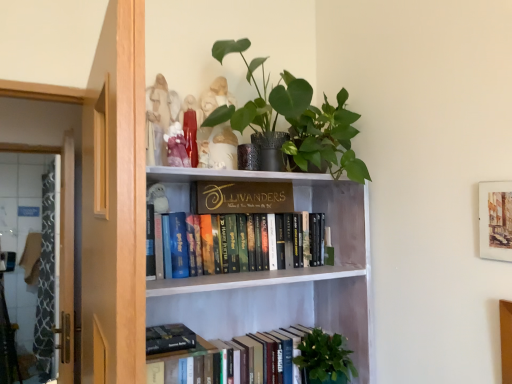
What do you see at coordinates (188, 356) in the screenshot? I see `hardcover book at lower center, placed as the first book when sorted from bottom to top` at bounding box center [188, 356].

What do you see at coordinates (283, 273) in the screenshot? I see `white wood bookshelf at upper center` at bounding box center [283, 273].

The height and width of the screenshot is (384, 512). Describe the element at coordinates (242, 197) in the screenshot. I see `gold metallic sign at upper center` at that location.

Measure the distance between green matte plant at upper center and camera.

green matte plant at upper center and camera are 1.31 meters apart.

Locate an element on the screen. green matte plant at lower center is located at coordinates (325, 358).

Find the location of a particular element. The width and height of the screenshot is (512, 384). watercolor paper picture frame at upper right is located at coordinates (495, 220).

From a real-world perspective, who is located higher, hardcover books at center, arranged as the second book when ordered from the bottom, or green matte plant at lower center?

In real-world perspective, hardcover books at center, arranged as the second book when ordered from the bottom, is above.

Who is smaller, hardcover books at center, the first book from the top, or green matte plant at lower center?

green matte plant at lower center.

Can you confirm if hardcover books at center, the first book from the top, is thinner than green matte plant at lower center?

Correct, the width of hardcover books at center, the first book from the top, is less than that of green matte plant at lower center.

From a real-world perspective, is gold metallic sign at upper center positioned above or below green matte plant at upper center?

Clearly, from a real-world perspective, gold metallic sign at upper center is below green matte plant at upper center.

Which of these two, gold metallic sign at upper center or green matte plant at upper center, is thinner?

gold metallic sign at upper center.

Is gold metallic sign at upper center not close to green matte plant at upper center?

That's not correct — gold metallic sign at upper center is a little close to green matte plant at upper center.

Between wooden screen door at left and green matte plant at lower center, which one appears on the left side from the viewer's perspective?

Positioned to the left is wooden screen door at left.

Considering their positions, is wooden screen door at left located in front of or behind green matte plant at lower center?

Clearly, wooden screen door at left is behind green matte plant at lower center.

From the image's perspective, is wooden screen door at left above green matte plant at lower center?

Yes, from the image's perspective, wooden screen door at left is over green matte plant at lower center.

Does hardcover books at center, arranged as the second book when ordered from the bottom, have a lesser height compared to hardcover book at lower center, the 2th book in the top-to-bottom sequence?

In fact, hardcover books at center, arranged as the second book when ordered from the bottom, may be taller than hardcover book at lower center, the 2th book in the top-to-bottom sequence.

Locate an element on the screen. book above the hardcover book at lower center, the 2th book in the top-to-bottom sequence (from a real-world perspective) is located at coordinates (246, 276).

Which of these two, hardcover books at center, the first book from the top, or hardcover book at lower center, the 2th book in the top-to-bottom sequence, is wider?

hardcover book at lower center, the 2th book in the top-to-bottom sequence, is wider.

Measure the distance from hardcover books at center, arranged as the second book when ordered from the bottom, to hardcover book at lower center, placed as the first book when sorted from bottom to top.

A distance of 11.28 inches exists between hardcover books at center, arranged as the second book when ordered from the bottom, and hardcover book at lower center, placed as the first book when sorted from bottom to top.

From the image's perspective, which one is positioned lower, wooden screen door at left or watercolor paper picture frame at upper right?

wooden screen door at left, from the image's perspective.

Considering the positions of objects wooden screen door at left and watercolor paper picture frame at upper right in the image provided, who is more to the left, wooden screen door at left or watercolor paper picture frame at upper right?

wooden screen door at left.

Is green matte plant at upper center inside the boundaries of wooden screen door at left, or outside?

green matte plant at upper center is spatially situated outside wooden screen door at left.

Are green matte plant at upper center and wooden screen door at left located far from each other?

green matte plant at upper center is positioned a significant distance from wooden screen door at left.

From the image's perspective, is green matte plant at upper center beneath wooden screen door at left?

No, from the image's perspective, green matte plant at upper center is not beneath wooden screen door at left.

Looking at this image, how different are the orientations of green matte plant at upper center and wooden screen door at left in degrees?

They differ by 88.9 degrees in their facing directions.

How many degrees apart are the facing directions of green matte plant at lower center and wooden screen door at left?

green matte plant at lower center and wooden screen door at left are facing 88.9 degrees away from each other.

Is the position of green matte plant at lower center less distant than that of wooden screen door at left?

Yes, green matte plant at lower center is in front of wooden screen door at left.

Is green matte plant at lower center not close to wooden screen door at left?

Yes, green matte plant at lower center and wooden screen door at left are quite far apart.

Who is taller, green matte plant at lower center or wooden screen door at left?

With more height is wooden screen door at left.

The image size is (512, 384). Find the location of `vegetation on the right of hardcover books at center, arranged as the second book when ordered from the bottom`. vegetation on the right of hardcover books at center, arranged as the second book when ordered from the bottom is located at coordinates tap(325, 358).

You are a GUI agent. You are given a task and a screenshot of the screen. Output one action in this format:
    pyautogui.click(x=<x>, y=<y>)
    Task: Click on the paperback book behind the green matte plant at upper center
    This screenshot has height=384, width=512.
    Given the screenshot: What is the action you would take?
    pyautogui.click(x=242, y=197)

From the image, which object appears to be nearer to hardcover books at center, arranged as the second book when ordered from the bottom, watercolor paper picture frame at upper right or hardcover book at lower center, placed as the first book when sorted from bottom to top?

Based on the image, hardcover book at lower center, placed as the first book when sorted from bottom to top, appears to be nearer to hardcover books at center, arranged as the second book when ordered from the bottom.

Which object lies nearer to the anchor point gold metallic sign at upper center, hardcover books at center, arranged as the second book when ordered from the bottom, or watercolor paper picture frame at upper right?

hardcover books at center, arranged as the second book when ordered from the bottom, lies closer to gold metallic sign at upper center than the other object.

From the image, which object appears to be nearer to hardcover books at center, arranged as the second book when ordered from the bottom, gold metallic sign at upper center or green matte plant at lower center?

gold metallic sign at upper center is positioned closer to the anchor hardcover books at center, arranged as the second book when ordered from the bottom.

Based on their spatial positions, is green matte plant at lower center or hardcover books at center, arranged as the second book when ordered from the bottom, further from gold metallic sign at upper center?

Based on the image, green matte plant at lower center appears to be further to gold metallic sign at upper center.

Considering their positions, is hardcover book at lower center, placed as the first book when sorted from bottom to top, positioned closer to white wood bookshelf at upper center than watercolor paper picture frame at upper right?

Among the two, hardcover book at lower center, placed as the first book when sorted from bottom to top, is located nearer to white wood bookshelf at upper center.

From the image, which object appears to be nearer to hardcover book at lower center, the 2th book in the top-to-bottom sequence, green matte plant at lower center or white wood bookshelf at upper center?

white wood bookshelf at upper center is positioned closer to the anchor hardcover book at lower center, the 2th book in the top-to-bottom sequence.

Based on their spatial positions, is white wood bookshelf at upper center or hardcover book at lower center, the 2th book in the top-to-bottom sequence, closer to green matte plant at lower center?

The object closer to green matte plant at lower center is hardcover book at lower center, the 2th book in the top-to-bottom sequence.

Looking at the image, which one is located closer to wooden screen door at left, hardcover books at center, the first book from the top, or green matte plant at lower center?

hardcover books at center, the first book from the top, is positioned closer to the anchor wooden screen door at left.

Identify the location of bookcase located between hardcover books at center, the first book from the top, and watercolor paper picture frame at upper right in the left-right direction. This screenshot has width=512, height=384. (283, 273).

Where is `paperback book located between hardcover book at lower center, the 2th book in the top-to-bottom sequence, and watercolor paper picture frame at upper right in the left-right direction`? The height and width of the screenshot is (384, 512). paperback book located between hardcover book at lower center, the 2th book in the top-to-bottom sequence, and watercolor paper picture frame at upper right in the left-right direction is located at coordinates click(242, 197).

This screenshot has height=384, width=512. What are the coordinates of `paperback book between green matte plant at upper center and green matte plant at lower center vertically` in the screenshot? It's located at (242, 197).

At what (x,y) coordinates should I click in order to perform the action: click on book between gold metallic sign at upper center and green matte plant at lower center in the vertical direction. Please return your answer as a coordinate pair (x, y). This screenshot has height=384, width=512. Looking at the image, I should click on (246, 276).